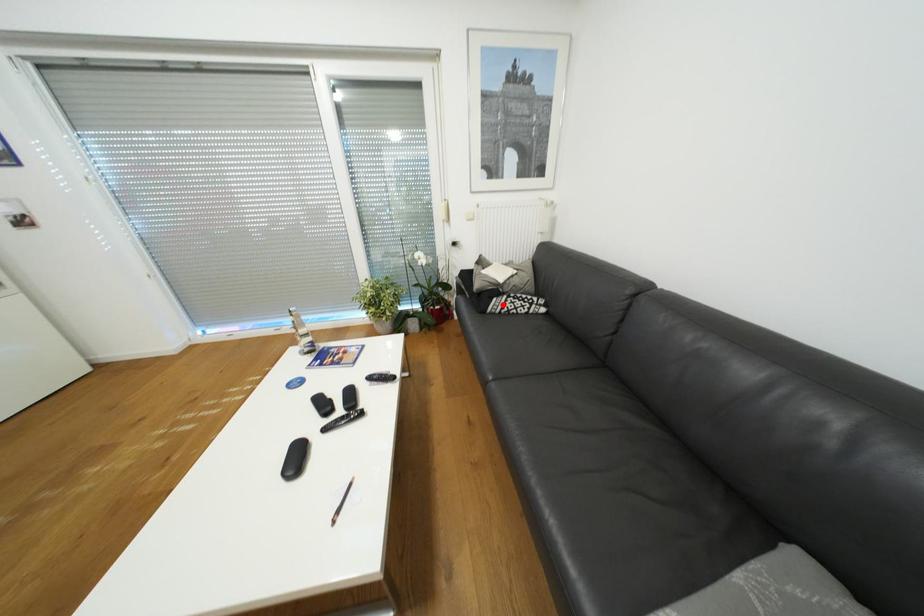
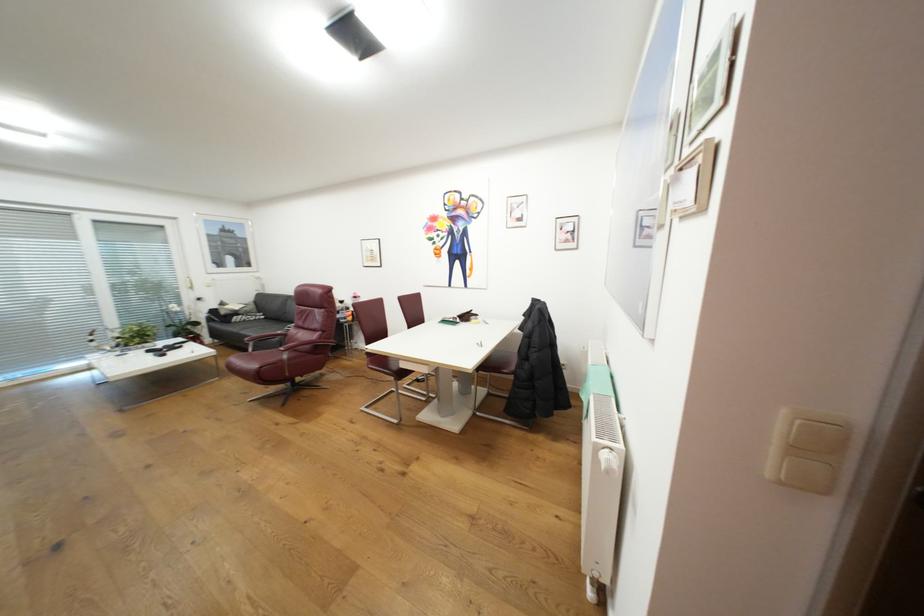
Question: A red point is marked in image1. In image2, is the corresponding 3D point closer to the camera or farther? Reply with the corresponding letter.

Choices:
 (A) The corresponding 3D point is closer.
 (B) The corresponding 3D point is farther.

Answer: (B)